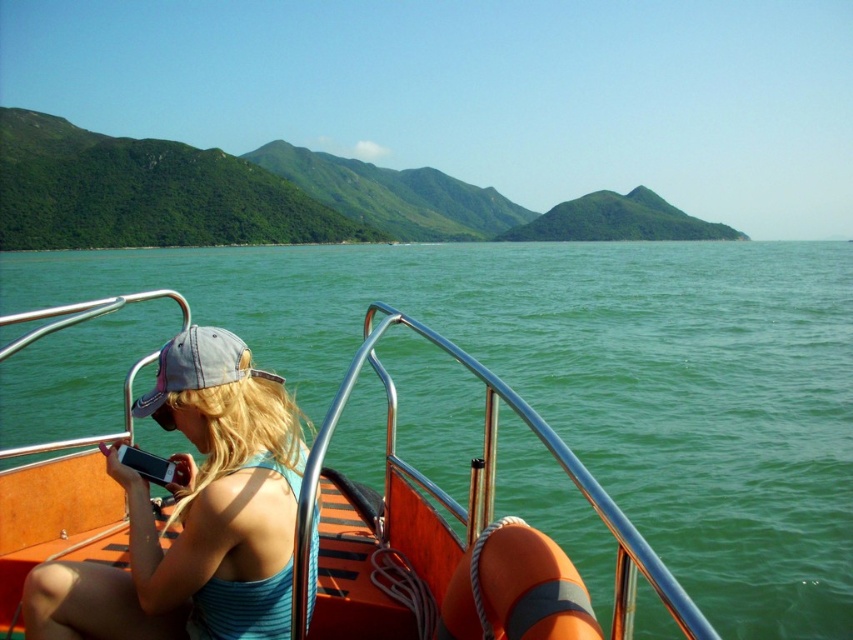
You are a passenger on the boat and want to move from the front to the back. Which object, the orange wood boat at center or the blue striped tank top at center, would you have to step over?

The orange wood boat at center is positioned over the blue striped tank top at center, so you would have to step over the orange wood boat at center to move from the front to the back.

You are navigating a drone to capture aerial footage of the orange wood boat at center. The drone is currently at coordinates 0.7, 0.5. To adjust the drone to the boat, should you move it north or south?

The orange wood boat at center is located at coordinates [442,522]. Since the drone is at [426,448], which is to the west and slightly south of the boat, you should move the drone east and north to align with the boat.

You are standing on the deck of the boat and want to locate the orange wood boat at center. Where should you look relative to the point marked at coordinates (442,522)?

The orange wood boat at center is located exactly at the point marked at coordinates (442,522).